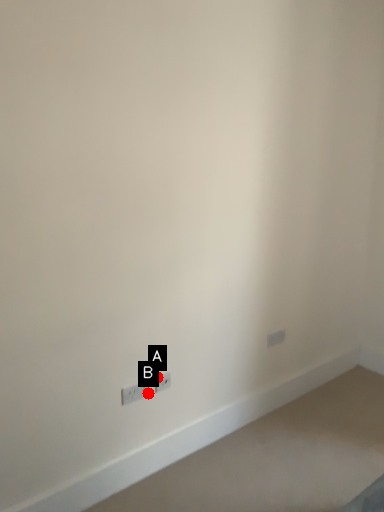
Question: Two points are circled on the image, labeled by A and B beside each circle. Which point is farther from the camera taking this photo?

Choices:
 (A) A is further
 (B) B is further

Answer: (A)